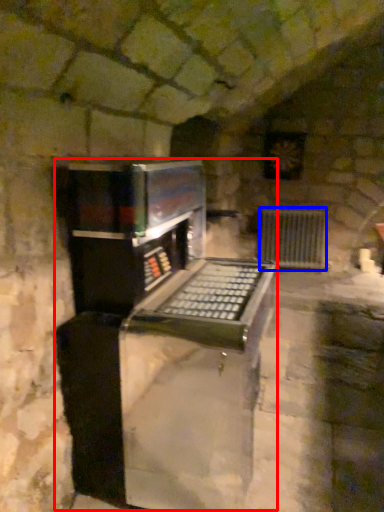
Question: Which point is closer to the camera, appliance (highlighted by a red box) or radiator (highlighted by a blue box)?

Choices:
 (A) appliance
 (B) radiator

Answer: (A)